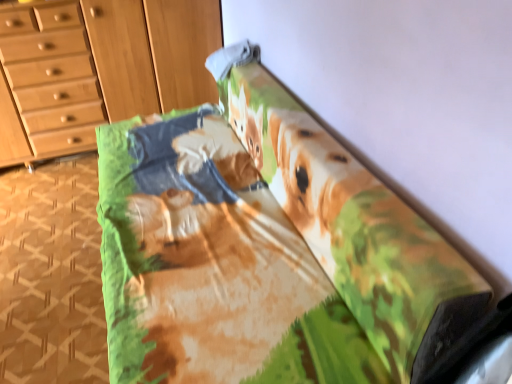
Where is `wooden chest of drawers at left`? This screenshot has width=512, height=384. wooden chest of drawers at left is located at coordinates (97, 68).

What is the approximate height of wooden chest of drawers at left?

wooden chest of drawers at left is 1.04 meters in height.

This screenshot has width=512, height=384. What do you see at coordinates (97, 68) in the screenshot? I see `wooden chest of drawers at left` at bounding box center [97, 68].

Find the location of a particular element. This screenshot has width=512, height=384. wooden chest of drawers at left is located at coordinates (97, 68).